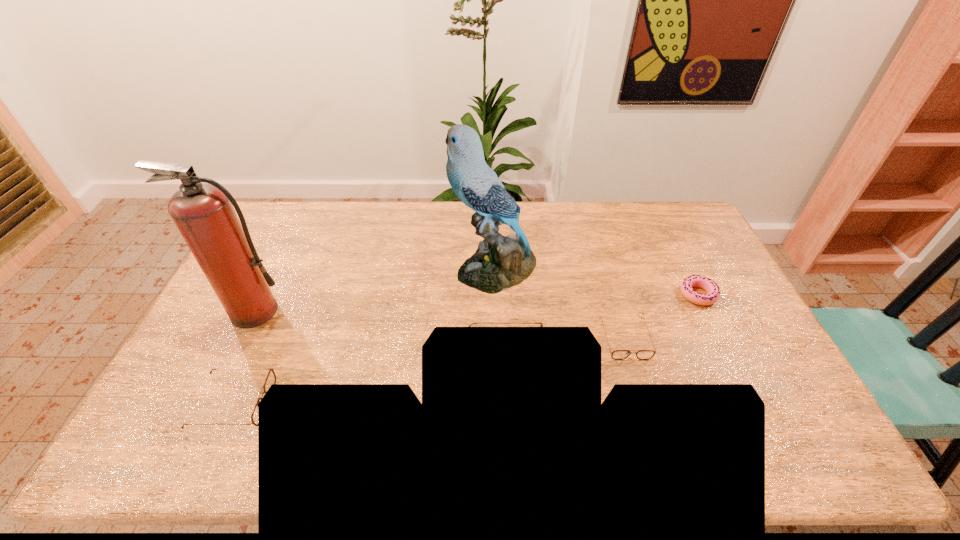
You are a GUI agent. You are given a task and a screenshot of the screen. Output one action in this format:
    pyautogui.click(x=<x>, y=<y>)
    Task: Click on the leftmost sunglasses
    This screenshot has width=960, height=540.
    Given the screenshot: What is the action you would take?
    pyautogui.click(x=271, y=377)

Locate an element on the screen. The height and width of the screenshot is (540, 960). the second shortest sunglasses is located at coordinates (271, 377).

Find the location of a particular element. This screenshot has width=960, height=540. the tallest sunglasses is located at coordinates (541, 324).

You are a GUI agent. You are given a task and a screenshot of the screen. Output one action in this format:
    pyautogui.click(x=<x>, y=<y>)
    Task: Click on the second sunglasses from right to left
    
    Given the screenshot: What is the action you would take?
    pyautogui.click(x=541, y=324)

Where is `the rightmost sunglasses`? Image resolution: width=960 pixels, height=540 pixels. the rightmost sunglasses is located at coordinates [617, 354].

The width and height of the screenshot is (960, 540). Find the location of `the second object from right to left`. the second object from right to left is located at coordinates (617, 354).

Where is `parakeet`? parakeet is located at coordinates (500, 262).

Locate an element on the screen. fire extinguisher is located at coordinates (203, 213).

Where is `doughnut`? This screenshot has width=960, height=540. doughnut is located at coordinates (710, 287).

Identify the location of vacant space located on the front-facing side of the leftmost sunglasses. The width and height of the screenshot is (960, 540). (375, 403).